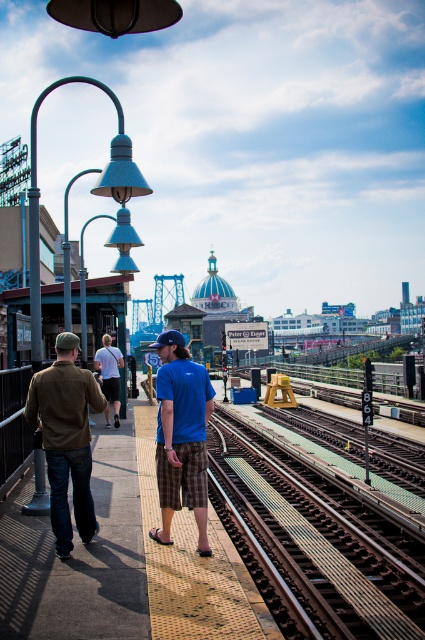
You are standing on the platform and want to greet the person in the matte brown jacket at left. Which direction should you move relative to the white cotton shirt at center?

Since the matte brown jacket at left is to the right of the white cotton shirt at center, you should move to the right of the white cotton shirt at center to reach the matte brown jacket at left.